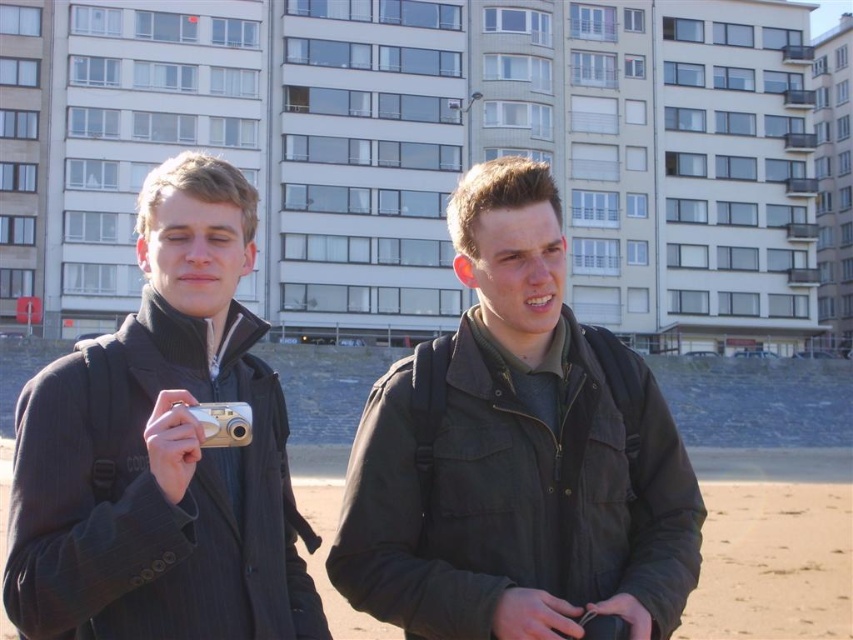
Does sandy beach at lower center have a greater height compared to silver metallic camera at center?

Correct, sandy beach at lower center is much taller as silver metallic camera at center.

Is sandy beach at lower center smaller than silver metallic camera at center?

No, sandy beach at lower center is not smaller than silver metallic camera at center.

The height and width of the screenshot is (640, 853). I want to click on sandy beach at lower center, so click(772, 545).

Measure the distance from matte black jacket at center to sandy beach at lower center.

matte black jacket at center and sandy beach at lower center are 62.25 feet apart from each other.

From the picture: Does matte black jacket at center have a greater width compared to sandy beach at lower center?

No, matte black jacket at center is not wider than sandy beach at lower center.

Image resolution: width=853 pixels, height=640 pixels. Identify the location of matte black jacket at center. (165, 452).

Where is `matte black jacket at center`? The height and width of the screenshot is (640, 853). matte black jacket at center is located at coordinates (165, 452).

Identify the location of black matte jacket at center. This screenshot has height=640, width=853. (520, 456).

Is point (21, 445) positioned before point (717, 515)?

Yes.

Who is more forward, [491,548] or [720,592]?

Point [491,548]

Find the location of a particular element. black matte jacket at center is located at coordinates (520, 456).